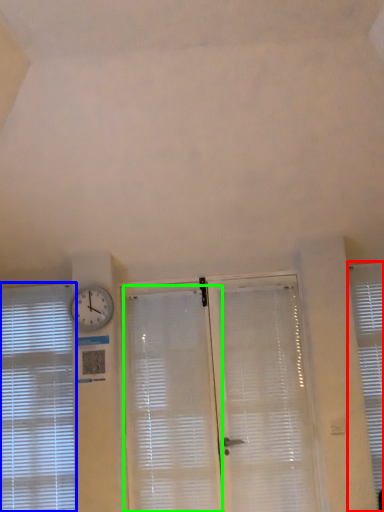
Question: Estimate the real-world distances between objects in this image. Which object is closer to window blind (highlighted by a red box), window blind (highlighted by a blue box) or shutter (highlighted by a green box)?

Choices:
 (A) window blind
 (B) shutter

Answer: (B)